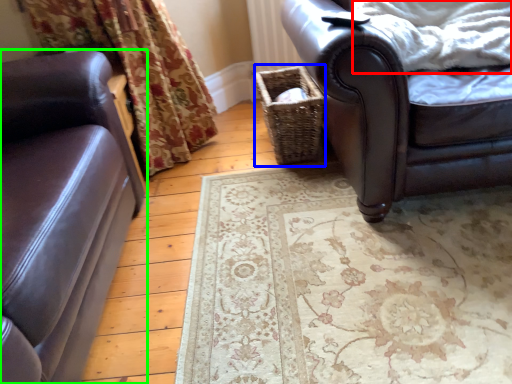
Question: Which is farther away from blanket (highlighted by a red box)? basket (highlighted by a blue box) or studio couch (highlighted by a green box)?

Choices:
 (A) basket
 (B) studio couch

Answer: (B)